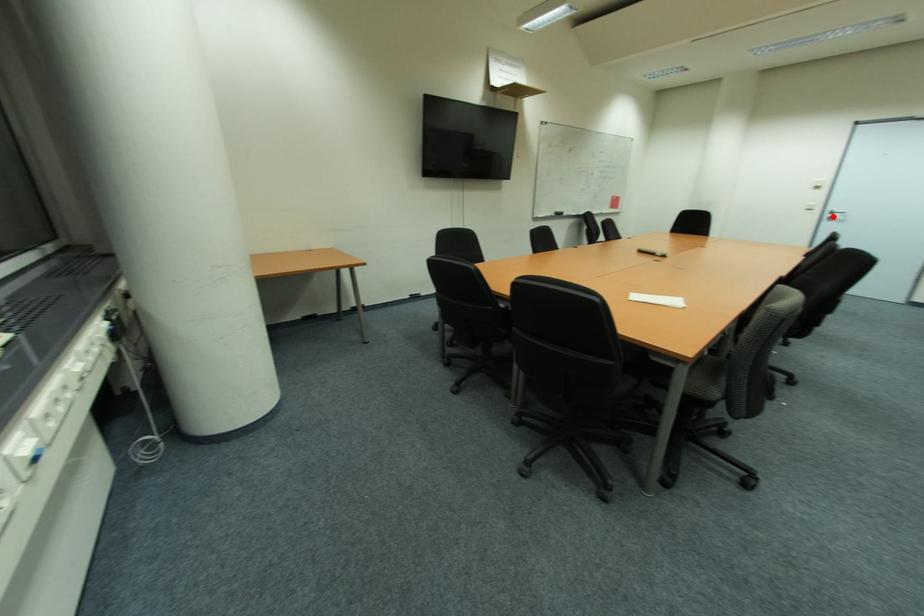
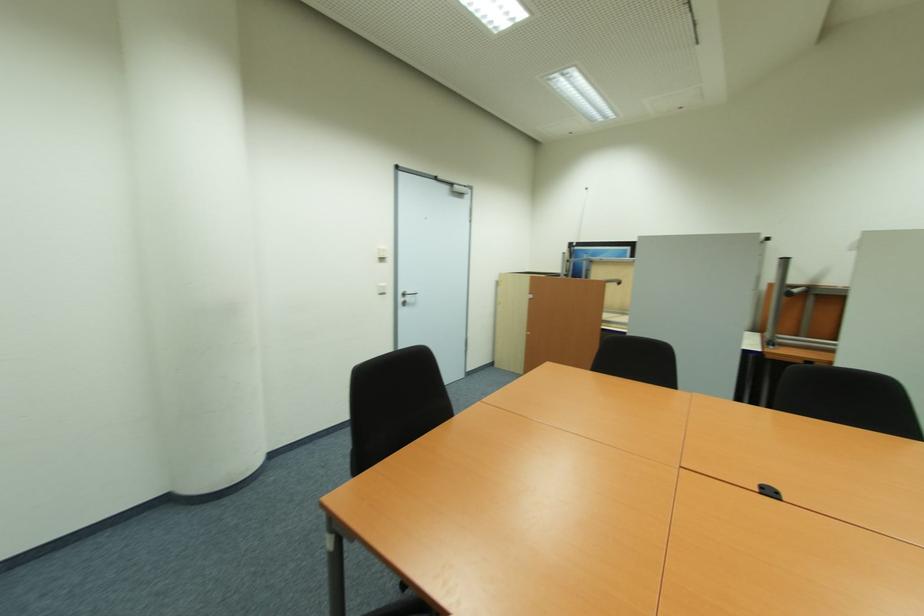
Locate, in the second image, the point that corresponds to the highlighted location in the first image.

(405, 300)